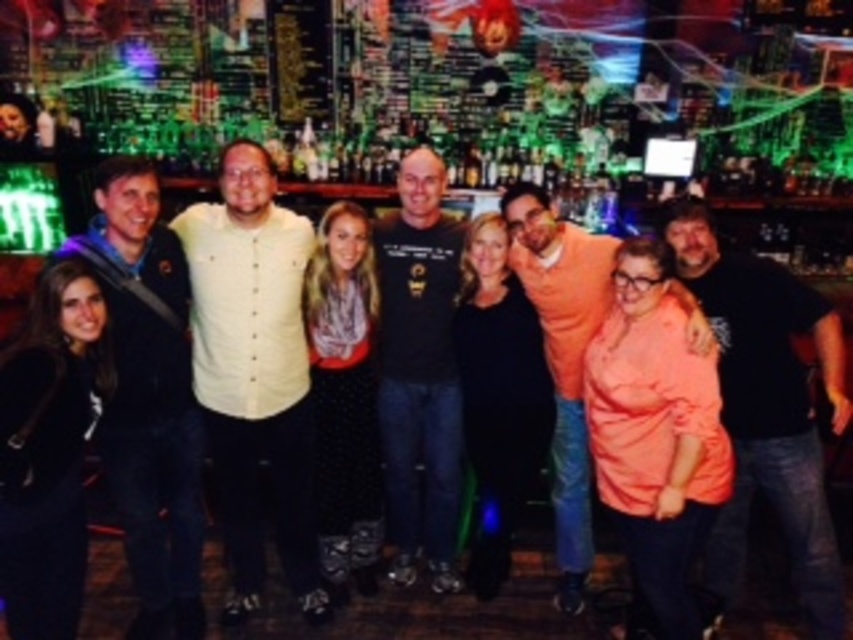
You are standing in front of a group photo taken at a bar with a city backdrop. You notice a specific point at coordinates (254, 371). Which item in the photo does this point belong to?

The point at coordinates (254, 371) is on the light yellow button up shirt at center.